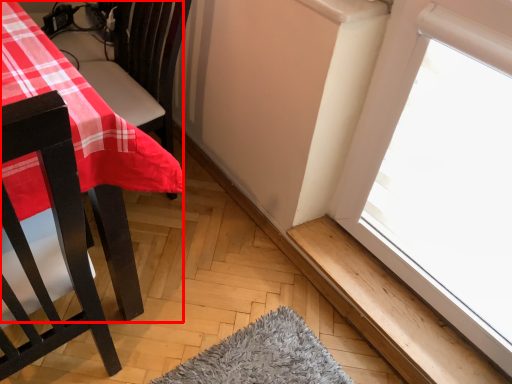
Question: From the image's perspective, where is table (annotated by the red box) located in relation to window sill in the image?

Choices:
 (A) above
 (B) below

Answer: (A)